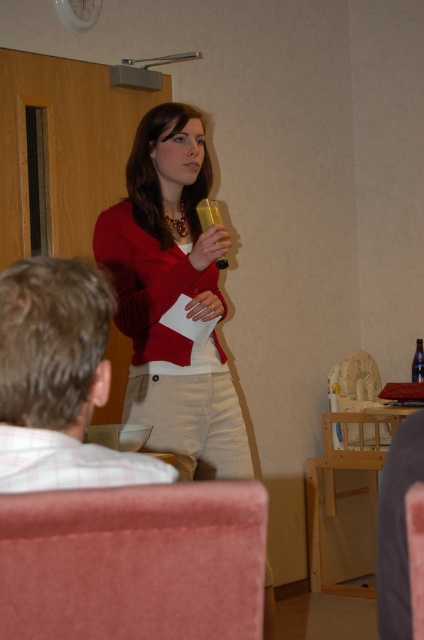
Question: Which of the following is the farthest from the observer?

Choices:
 (A) matte red sweater at center
 (B) translucent plastic cup at center

Answer: (A)

Question: Which object is the closest to the translucent plastic cup at center?

Choices:
 (A) translucent plastic bottle at center
 (B) pink fabric armchair at lower left
 (C) plaid shirt at left

Answer: (C)

Question: Where is pink fabric armchair at lower left located in relation to translucent plastic bottle at center in the image?

Choices:
 (A) right
 (B) left

Answer: (B)

Question: Is matte red sweater at center below translucent plastic cup at center?

Choices:
 (A) no
 (B) yes

Answer: (B)

Question: Is pink fabric armchair at lower left above matte red sweater at center?

Choices:
 (A) no
 (B) yes

Answer: (A)

Question: Which of the following is the closest to the observer?

Choices:
 (A) translucent plastic cup at center
 (B) plaid shirt at left
 (C) translucent plastic bottle at center

Answer: (B)